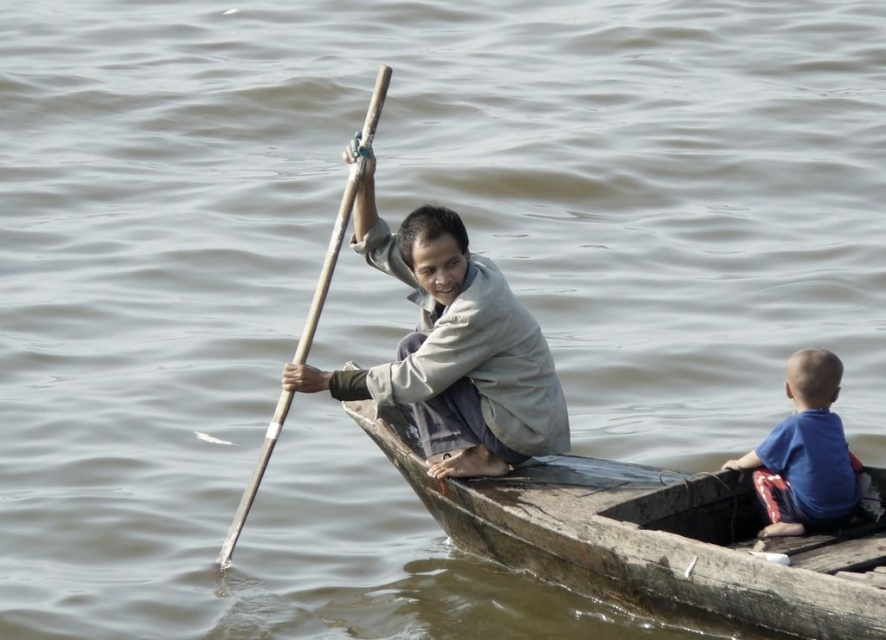
You are standing on the shore and see the wooden boat at center and the blue cotton shirt at upper center in the image. Which object is closer to you?

The wooden boat at center is closer to you because it is in front of the blue cotton shirt at upper center.

You are a photographer trying to capture a photo of the wooden boat at center and the blue cotton shirt at upper center. Since you want both subjects to appear proportionally sized in the photo, which object should you move closer to?

The wooden boat at center is larger than the blue cotton shirt at upper center, so you should move closer to the wooden boat at center to reduce its size in the photo and balance the proportions.

You are planning to place a small cooler on the wooden boat at center. The cooler is as wide as the blue cotton shirt at upper center. Will the cooler fit on the boat without overhanging the edges?

The wooden boat at center might be wider than blue cotton shirt at upper center, so the cooler, which is as wide as the blue cotton shirt at upper center, should fit on the boat without overhanging the edges since the boat is likely wider.